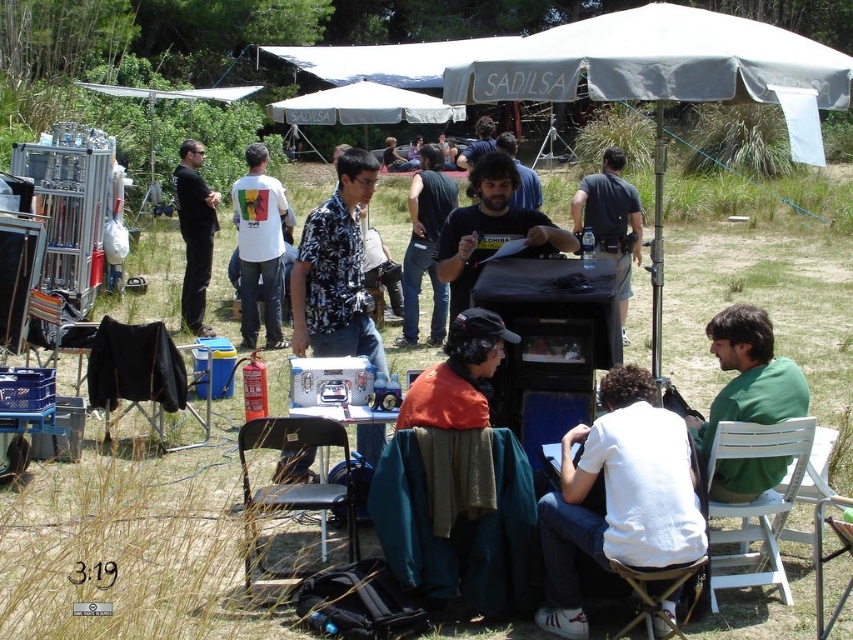
Question: Is green fabric chair at lower center smaller than black plastic chair at lower center?

Choices:
 (A) no
 (B) yes

Answer: (B)

Question: Does orange fabric jacket at center appear on the right side of black shirt at left?

Choices:
 (A) no
 (B) yes

Answer: (B)

Question: Which object appears farthest from the camera in this image?

Choices:
 (A) black fabric chair at lower left
 (B) dark brown hair at center
 (C) green cotton shirt at right

Answer: (A)

Question: Does green fabric chair at lower center appear on the left side of black matte shirt at center?

Choices:
 (A) yes
 (B) no

Answer: (A)

Question: Which object is the closest to the green cotton shirt at right?

Choices:
 (A) black shirt at left
 (B) white matte t-shirt at center
 (C) white wood chair at lower right

Answer: (C)

Question: Which object is farther from the camera taking this photo?

Choices:
 (A) metallic silver chair at lower right
 (B) orange fabric jacket at center
 (C) white plastic chair at lower right
 (D) white fabric canopy at upper center

Answer: (D)